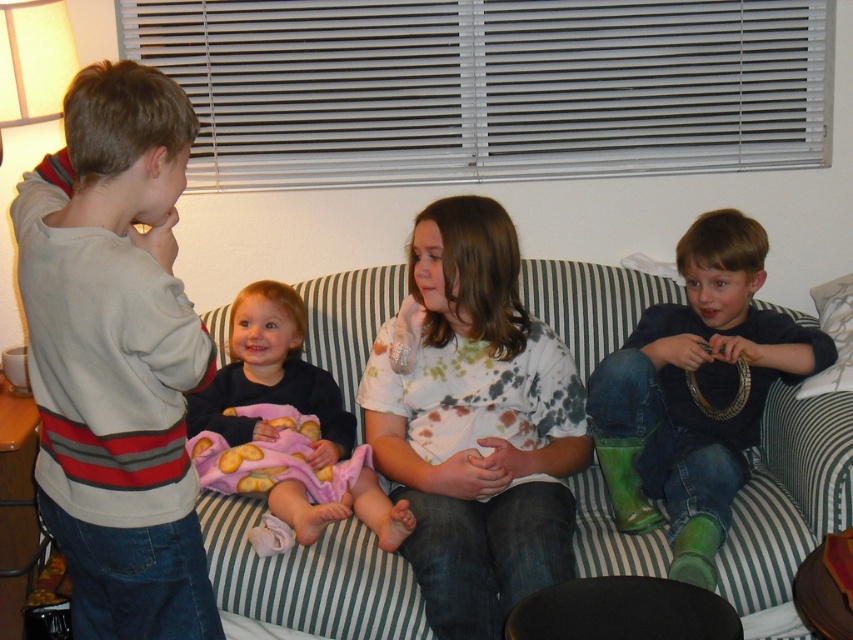
From the picture: Between tie-dye fabric shirt at center and pink fleece blanket at center, which one has more height?

Standing taller between the two is tie-dye fabric shirt at center.

Find the location of `tie-dye fabric shirt at center`. tie-dye fabric shirt at center is located at coordinates (477, 426).

Locate an element on the screen. The height and width of the screenshot is (640, 853). tie-dye fabric shirt at center is located at coordinates (477, 426).

Identify the location of tie-dye fabric shirt at center. (477, 426).

Does green striped couch at center have a greater height compared to pink fleece blanket at center?

Incorrect, green striped couch at center's height is not larger of pink fleece blanket at center's.

Is green striped couch at center to the left of pink fleece blanket at center from the viewer's perspective?

In fact, green striped couch at center is to the right of pink fleece blanket at center.

Between point (817, 435) and point (323, 522), which one is positioned in front?

Point (323, 522)

I want to click on green striped couch at center, so click(x=310, y=577).

Does green rubber boots at right appear on the left side of pink fleece blanket at center?

Incorrect, green rubber boots at right is not on the left side of pink fleece blanket at center.

Is point (665, 448) farther from viewer compared to point (386, 509)?

Yes, point (665, 448) is farther from viewer.

I want to click on green rubber boots at right, so [x=695, y=392].

Locate an element on the screen. The width and height of the screenshot is (853, 640). green rubber boots at right is located at coordinates (695, 392).